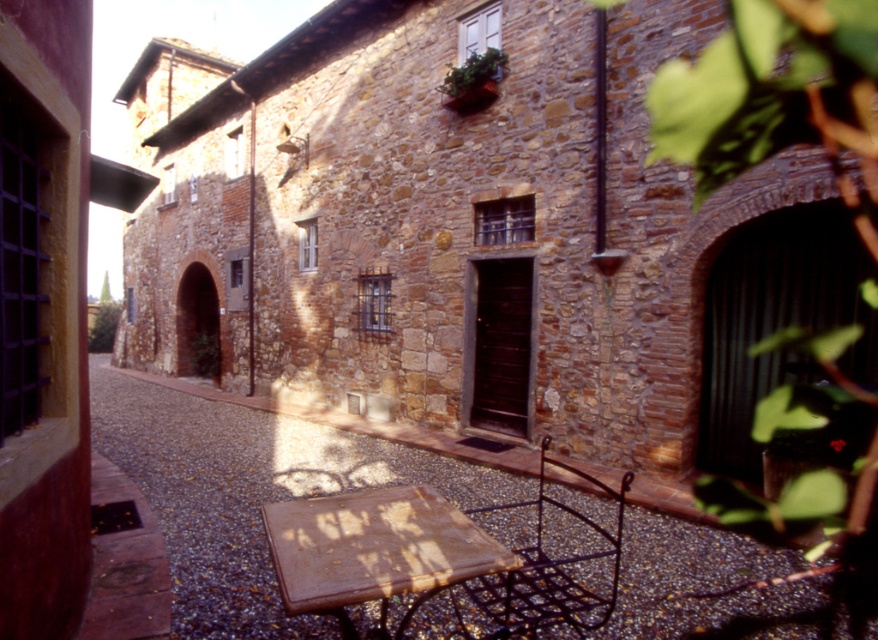
From the picture: You are a guest arriving at this historic building and need to sit down. You see the rusty metal table at lower center and the black wrought iron chair at lower right. Which object should you approach to find a place to sit?

The black wrought iron chair at lower right is the correct object to approach for seating, as the rusty metal table at lower center is positioned over it, indicating the chair is beneath the table and ready for use.

You are a visitor standing in front of the rustic stone building. You see a rusty metal table at lower center and a black wrought iron chair at lower right. Which object is wider?

The black wrought iron chair at lower right is wider than the rusty metal table at lower center.

You are standing in front of the rustic stone building and want to place a potted plant on the closest object to you between the rusty metal table at lower center and the black wrought iron chair at lower right. Which object should you choose?

The rusty metal table at lower center is closer to the viewer than the black wrought iron chair at lower right, so you should place the potted plant on the rusty metal table at lower center.